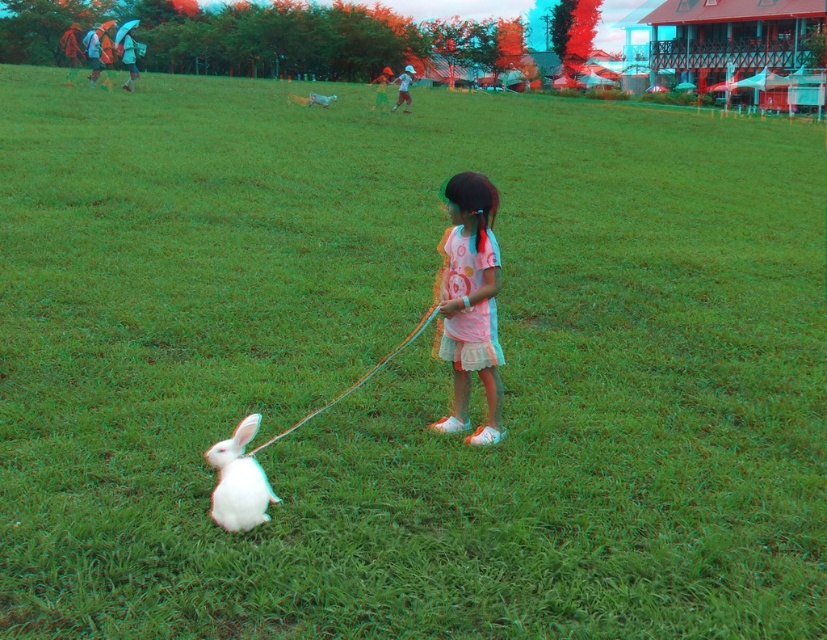
Question: Which of the following is the farthest from the observer?

Choices:
 (A) white fluffy rabbit at lower left
 (B) pink cotton dress at center

Answer: (B)

Question: Among these points, which one is nearest to the camera?

Choices:
 (A) (247, 506)
 (B) (480, 248)

Answer: (A)

Question: From the image, what is the correct spatial relationship of pink cotton dress at center in relation to white fluffy rabbit at lower left?

Choices:
 (A) below
 (B) above

Answer: (B)

Question: Does pink cotton dress at center appear over white fluffy rabbit at lower left?

Choices:
 (A) no
 (B) yes

Answer: (B)

Question: Does pink cotton dress at center have a larger size compared to white fluffy rabbit at lower left?

Choices:
 (A) yes
 (B) no

Answer: (A)

Question: Which point is closer to the camera taking this photo?

Choices:
 (A) pos(252,467)
 (B) pos(495,413)

Answer: (A)